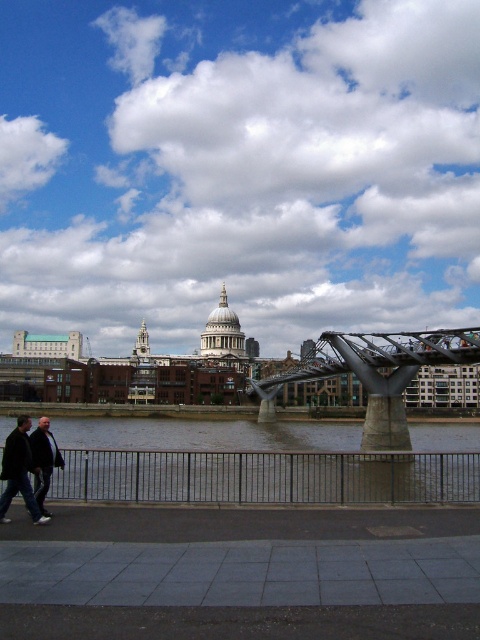
You are standing at the point with coordinates point (418, 337) and want to look towards the point with coordinates point (446, 284). In the riverside urban landscape scene, which direction should you turn to face that point?

You should turn to your left to face the point (446, 284) because it is behind point (418, 337), which means it is located to the left side from your current position.

In the scene shown: You are a photographer standing on the paved walkway and want to take a photo of the dark gray jacket at lower left and the metallic gray bridge at center. Which object will appear closer to the front of the photo?

The dark gray jacket at lower left is behind the metallic gray bridge at center, so the metallic gray bridge at center will appear closer to the front of the photo.